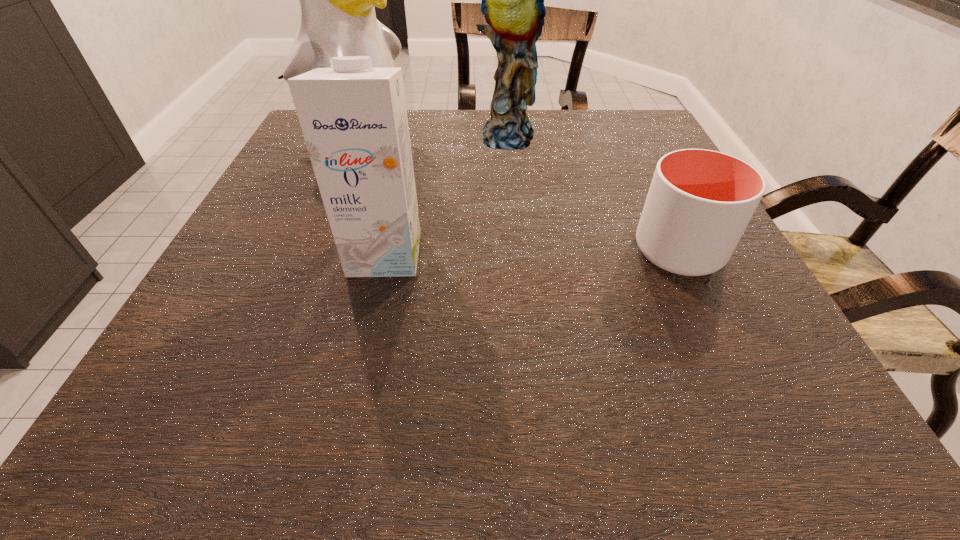
Where is `vacant space located 0.210m on the beak of the gull`? vacant space located 0.210m on the beak of the gull is located at coordinates (461, 201).

Locate an element on the screen. free region located on the beak of the gull is located at coordinates (436, 188).

Identify the location of vacant space positioned 0.120m on the beak of the gull. The width and height of the screenshot is (960, 540). (430, 184).

Identify the location of parrot present at the far edge. The image size is (960, 540). (512, 0).

At what (x,y) coordinates should I click in order to perform the action: click on gull present at the far edge. Please return your answer as a coordinate pair (x, y). Image resolution: width=960 pixels, height=540 pixels. Looking at the image, I should click on (337, 15).

Locate an element on the screen. The image size is (960, 540). object at the left edge is located at coordinates (337, 15).

The height and width of the screenshot is (540, 960). In order to click on object located at the right edge in this screenshot , I will do `click(699, 203)`.

I want to click on object that is at the far left corner, so click(x=337, y=15).

The width and height of the screenshot is (960, 540). In the image, there is a desktop. What are the coordinates of `vacant space at the far edge` in the screenshot? It's located at (412, 137).

The width and height of the screenshot is (960, 540). What are the coordinates of `vacant space at the near edge` in the screenshot? It's located at (309, 346).